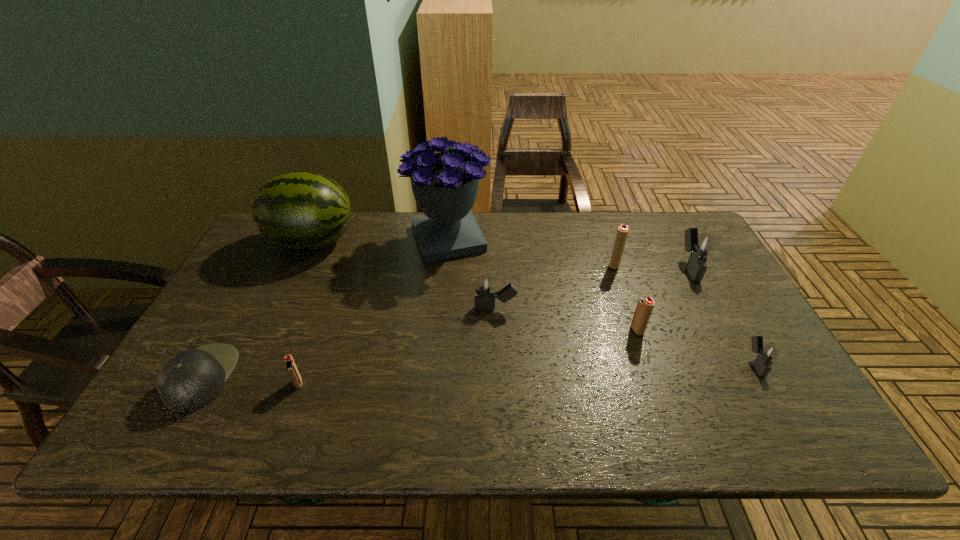
At what (x,y) coordinates should I click in order to perform the action: click on vacant space located 0.400m on the back of the smallest red igniter. Please return your answer as a coordinate pair (x, y). Looking at the image, I should click on (340, 267).

I want to click on vacant space situated 0.220m on the left of the smallest gray igniter, so click(x=655, y=363).

Image resolution: width=960 pixels, height=540 pixels. Find the location of `vacant space located 0.150m on the brim of the cap`. vacant space located 0.150m on the brim of the cap is located at coordinates (294, 377).

The image size is (960, 540). Identify the location of bouquet located at the far edge. (445, 185).

Where is `watermelon at the far edge`? This screenshot has width=960, height=540. watermelon at the far edge is located at coordinates pyautogui.click(x=300, y=210).

Locate an element on the screen. Image resolution: width=960 pixels, height=540 pixels. igniter at the far edge is located at coordinates (700, 246).

The width and height of the screenshot is (960, 540). I want to click on object that is at the near edge, so click(190, 380).

Where is `watermelon that is at the left edge`? The height and width of the screenshot is (540, 960). watermelon that is at the left edge is located at coordinates (300, 210).

Locate an element on the screen. This screenshot has height=540, width=960. cap at the left edge is located at coordinates (190, 380).

The image size is (960, 540). I want to click on object that is at the far left corner, so click(300, 210).